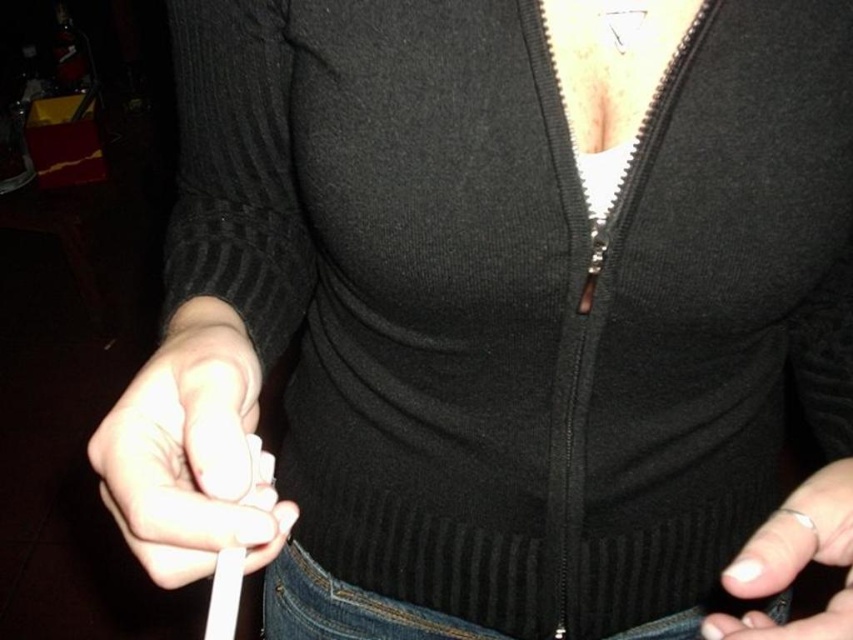
Between white matte remote control at lower left and jeans at lower center, which one is positioned higher?

Positioned higher is white matte remote control at lower left.

Consider the image. Is white matte remote control at lower left smaller than jeans at lower center?

Indeed, white matte remote control at lower left has a smaller size compared to jeans at lower center.

Locate an element on the screen. The height and width of the screenshot is (640, 853). white matte remote control at lower left is located at coordinates (190, 452).

Image resolution: width=853 pixels, height=640 pixels. I want to click on white matte remote control at lower left, so click(x=190, y=452).

Which is below, white matte nail at lower right or jeans at lower center?

Positioned lower is jeans at lower center.

Between white matte nail at lower right and jeans at lower center, which one has more height?

Standing taller between the two is white matte nail at lower right.

Is point (846, 496) positioned behind point (775, 611)?

That is False.

Locate an element on the screen. The width and height of the screenshot is (853, 640). white matte nail at lower right is located at coordinates (793, 561).

Does white matte remote control at lower left appear on the right side of white matte nail at lower right?

No, white matte remote control at lower left is not to the right of white matte nail at lower right.

Can you confirm if white matte remote control at lower left is shorter than white matte nail at lower right?

Yes, white matte remote control at lower left is shorter than white matte nail at lower right.

I want to click on white matte remote control at lower left, so click(190, 452).

What are the coordinates of `white matte remote control at lower left` in the screenshot? It's located at (190, 452).